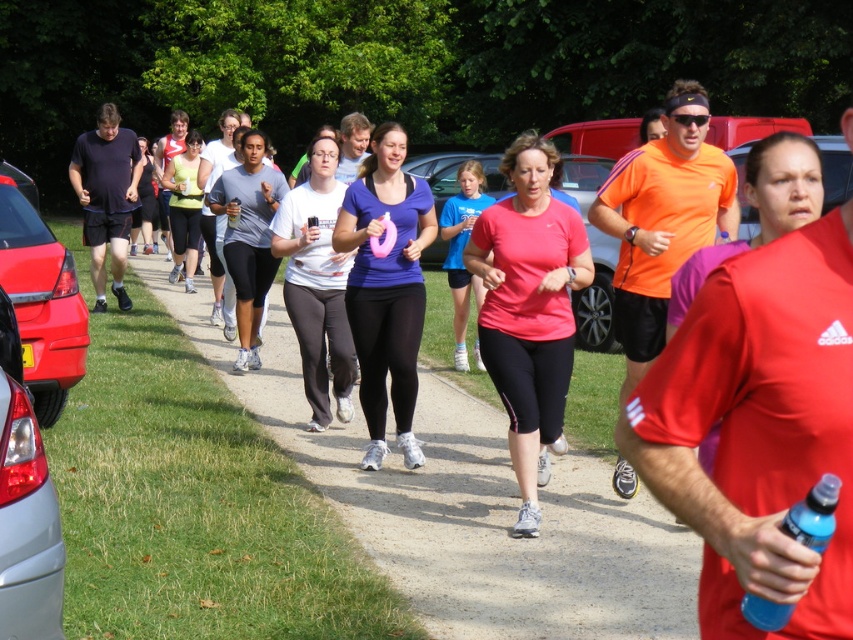
Question: Where is dirt path at center located in relation to blue plastic bottle at lower right in the image?

Choices:
 (A) above
 (B) below

Answer: (B)

Question: Estimate the real-world distances between objects in this image. Which object is farther from the matte black tank top at center?

Choices:
 (A) silver metallic car at lower left
 (B) matte black shorts at left

Answer: (A)

Question: Among these objects, which one is farthest from the camera?

Choices:
 (A) pink matte tank top at center
 (B) matte black tank top at center
 (C) white matte t-shirt at center
 (D) blue plastic bottle at lower right

Answer: (B)

Question: Is pink fabric shirt at center below matte purple shirt at center?

Choices:
 (A) yes
 (B) no

Answer: (A)

Question: Which object is farther from the camera taking this photo?

Choices:
 (A) matte black tank top at center
 (B) pink matte tank top at center

Answer: (A)

Question: Is metallic red car at left bigger than matte black shorts at left?

Choices:
 (A) no
 (B) yes

Answer: (B)